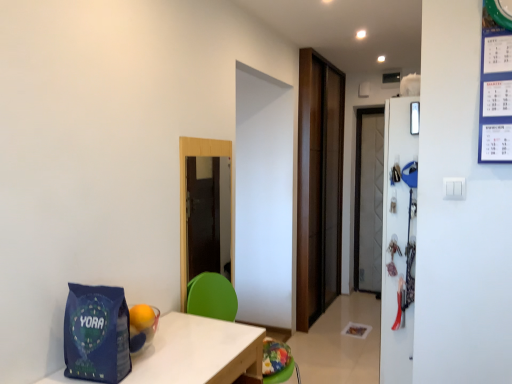
Question: Is brown wood door at center beside green plastic chair at center?

Choices:
 (A) no
 (B) yes

Answer: (A)

Question: From the image's perspective, is brown wood door at center located beneath green plastic chair at center?

Choices:
 (A) yes
 (B) no

Answer: (B)

Question: Could you tell me if brown wood door at center is facing green plastic chair at center?

Choices:
 (A) no
 (B) yes

Answer: (A)

Question: Would you say green plastic chair at center is part of brown wood door at center's contents?

Choices:
 (A) no
 (B) yes

Answer: (A)

Question: Would you say brown wood door at center is outside green plastic chair at center?

Choices:
 (A) yes
 (B) no

Answer: (A)

Question: Would you say brown wood door at center is to the left or to the right of blue matte gift bag at lower left in the picture?

Choices:
 (A) left
 (B) right

Answer: (B)

Question: Is brown wood door at center spatially inside blue matte gift bag at lower left, or outside of it?

Choices:
 (A) outside
 (B) inside

Answer: (A)

Question: Does point (325, 195) appear closer or farther from the camera than point (100, 286)?

Choices:
 (A) farther
 (B) closer

Answer: (A)

Question: From the image's perspective, is brown wood door at center positioned above or below blue matte gift bag at lower left?

Choices:
 (A) below
 (B) above

Answer: (B)

Question: From a real-world perspective, is white glossy refrigerator at right positioned above or below white wood table at lower left?

Choices:
 (A) above
 (B) below

Answer: (A)

Question: Considering the positions of white glossy refrigerator at right and white wood table at lower left in the image, is white glossy refrigerator at right wider or thinner than white wood table at lower left?

Choices:
 (A) thin
 (B) wide

Answer: (A)

Question: Considering the relative positions of white glossy refrigerator at right and white wood table at lower left in the image provided, is white glossy refrigerator at right to the left or to the right of white wood table at lower left?

Choices:
 (A) left
 (B) right

Answer: (B)

Question: In the image, is white glossy refrigerator at right positioned in front of or behind white wood table at lower left?

Choices:
 (A) front
 (B) behind

Answer: (B)

Question: Considering the positions of blue matte gift bag at lower left and green plastic chair at center in the image, is blue matte gift bag at lower left wider or thinner than green plastic chair at center?

Choices:
 (A) wide
 (B) thin

Answer: (B)

Question: Considering the positions of blue matte gift bag at lower left and green plastic chair at center in the image, is blue matte gift bag at lower left taller or shorter than green plastic chair at center?

Choices:
 (A) short
 (B) tall

Answer: (A)